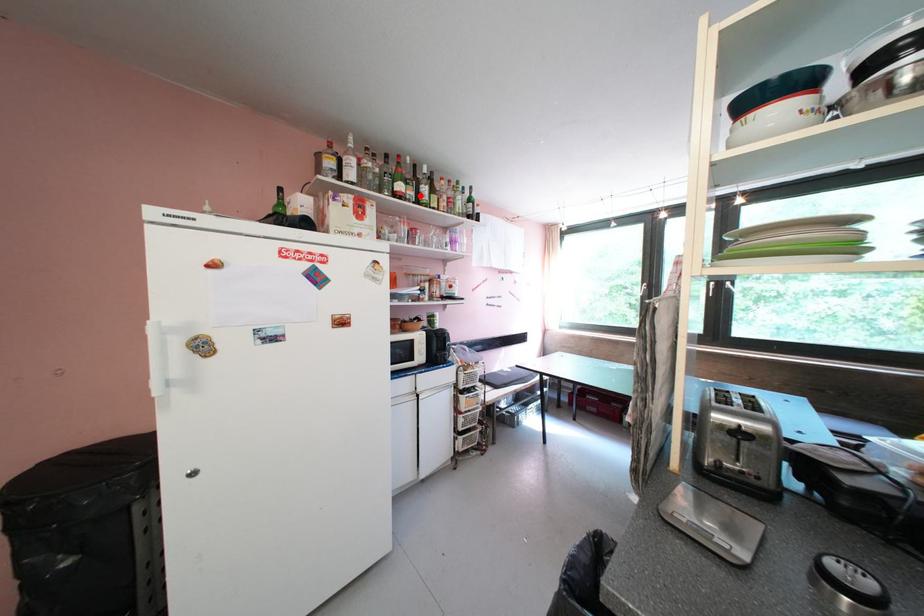
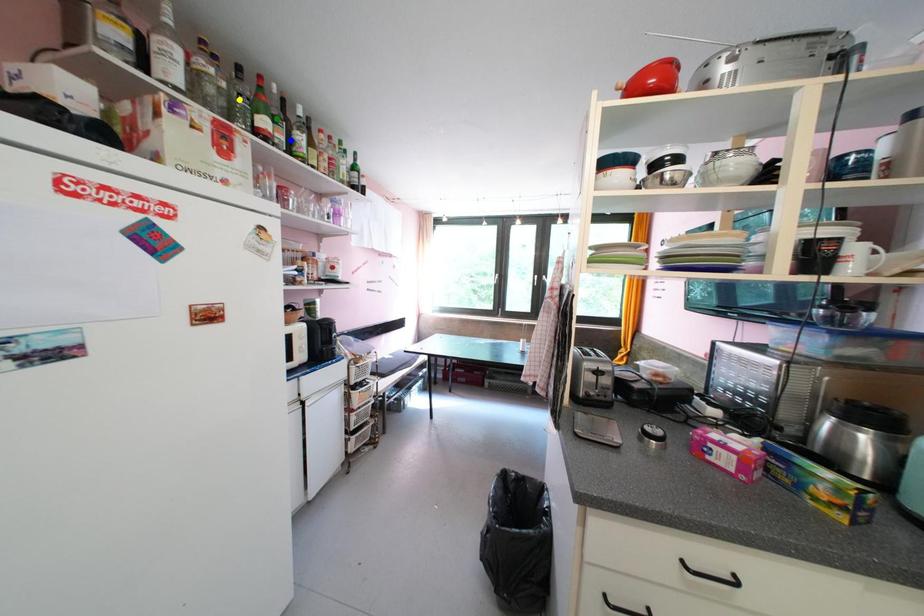
Question: I am providing you with two images of the same scene from different viewpoints. A red point is marked on the first image. You are given multiple points on the second image. Which point in image 2 is actually the same real-world point as the red point in image 1?

Choices:
 (A) blue point
 (B) green point
 (C) yellow point

Answer: (A)